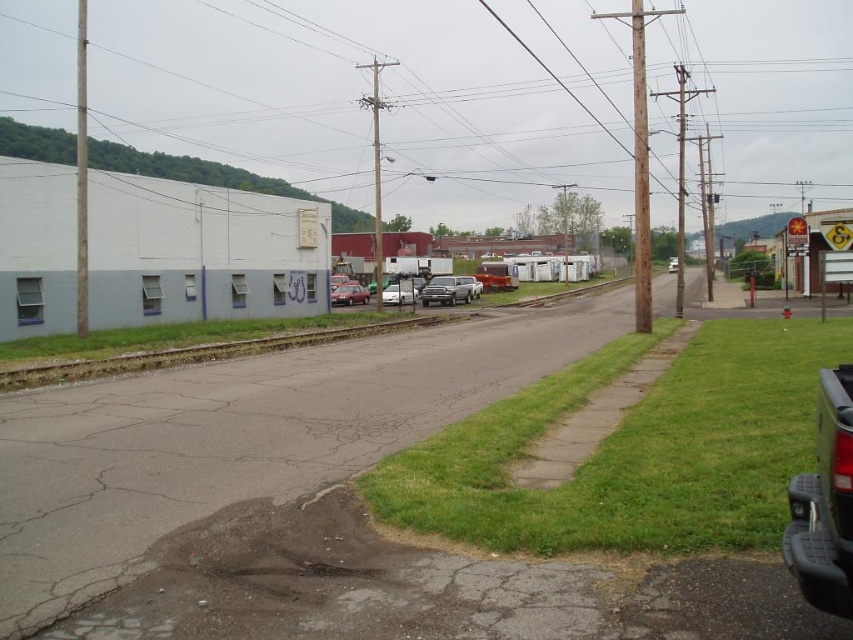
Consider the image. Between green grass at lower right and shiny silver sedan at center, which one has less height?

shiny silver sedan at center is shorter.

Is green grass at lower right wider than shiny silver sedan at center?

Indeed, green grass at lower right has a greater width compared to shiny silver sedan at center.

Image resolution: width=853 pixels, height=640 pixels. Find the location of `green grass at lower right`. green grass at lower right is located at coordinates (633, 451).

Does point (788, 97) lie in front of point (357, 285)?

No, it is not.

Which of these two, brown wooden utility pole at upper center or metallic red car at center, stands taller?

brown wooden utility pole at upper center is taller.

What do you see at coordinates (350, 99) in the screenshot? This screenshot has height=640, width=853. I see `brown wooden utility pole at upper center` at bounding box center [350, 99].

In order to click on brown wooden utility pole at upper center in this screenshot , I will do `click(350, 99)`.

Who is more forward, (462, 291) or (341, 301)?

Point (341, 301) is more forward.

Between satin silver truck at center and metallic red car at center, which one appears on the right side from the viewer's perspective?

satin silver truck at center is more to the right.

Is point (468, 296) positioned behind point (357, 294)?

Yes.

This screenshot has width=853, height=640. Identify the location of satin silver truck at center. (447, 289).